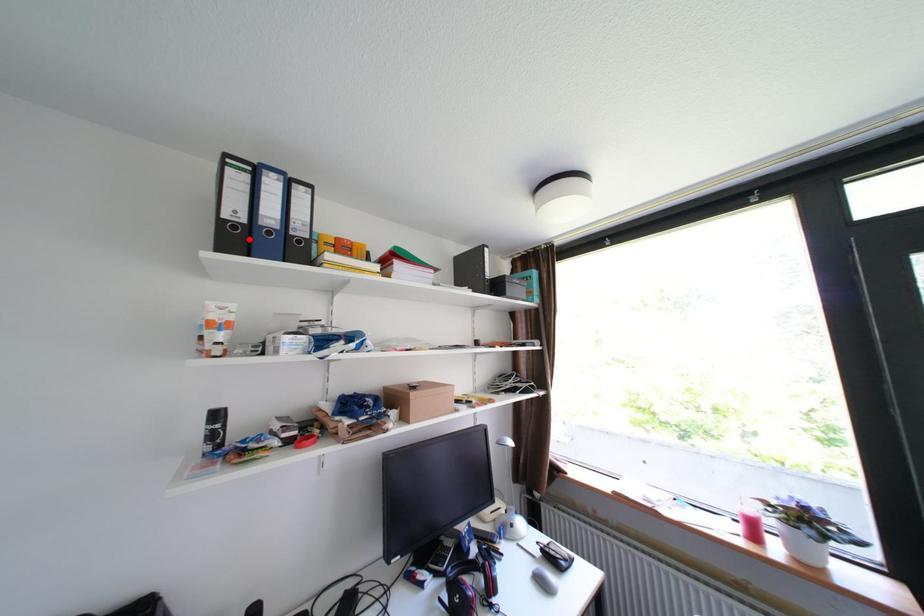
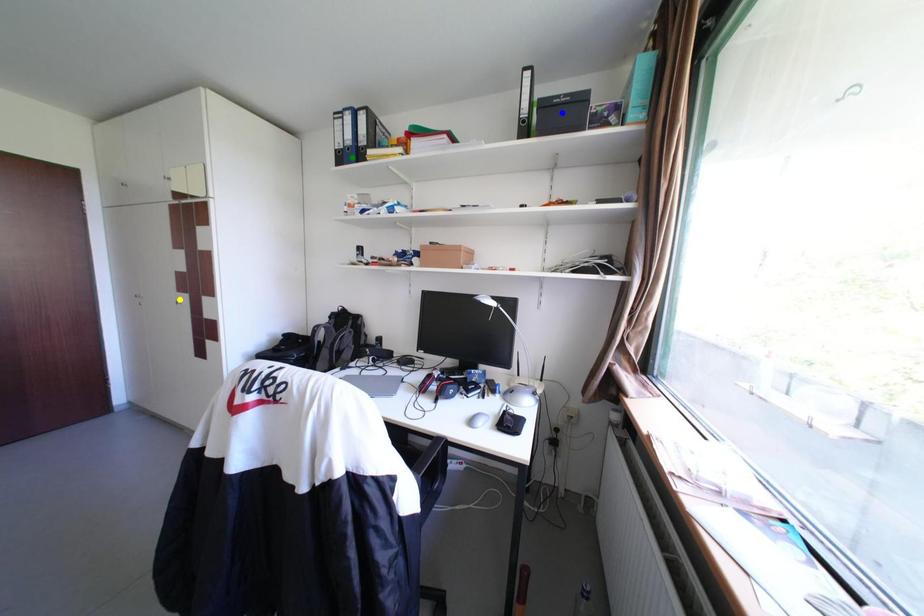
Question: I am providing you with two images of the same scene from different viewpoints. A red point is marked on the first image. You are given multiple points on the second image. Which spot in image 2 lines up with the point in image 1?

Choices:
 (A) yellow point
 (B) blue point
 (C) green point

Answer: (C)